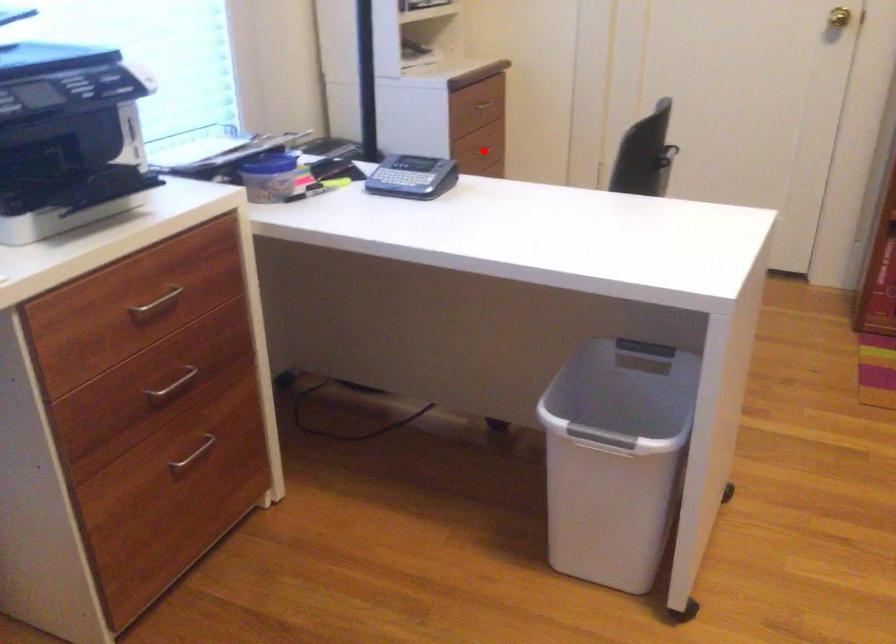
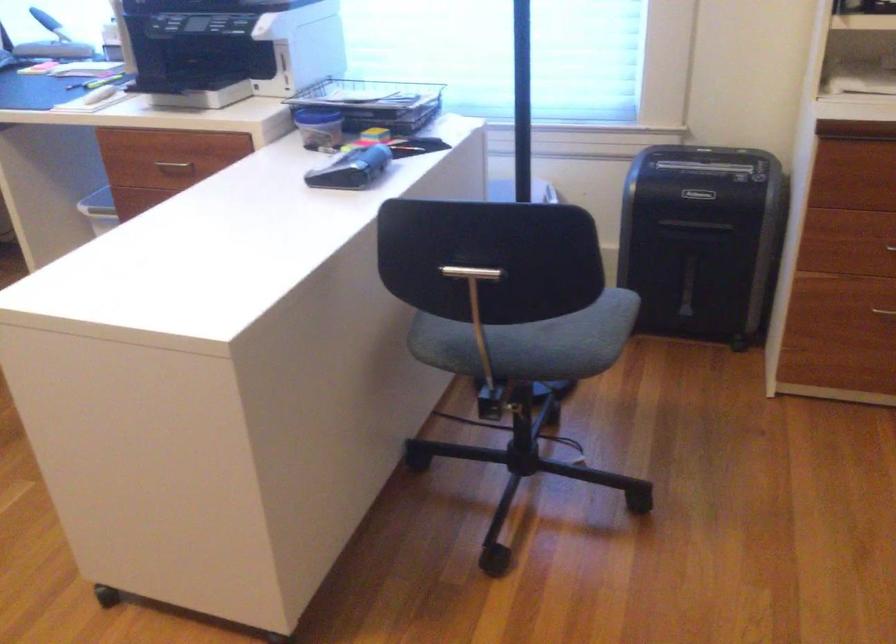
The point at the highlighted location is marked in the first image. Where is the corresponding point in the second image?

(890, 247)